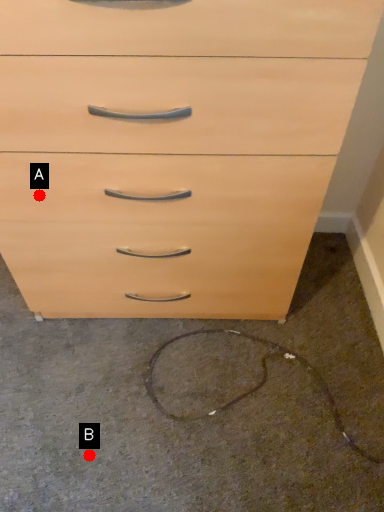
Question: Two points are circled on the image, labeled by A and B beside each circle. Which point is closer to the camera taking this photo?

Choices:
 (A) A is closer
 (B) B is closer

Answer: (A)